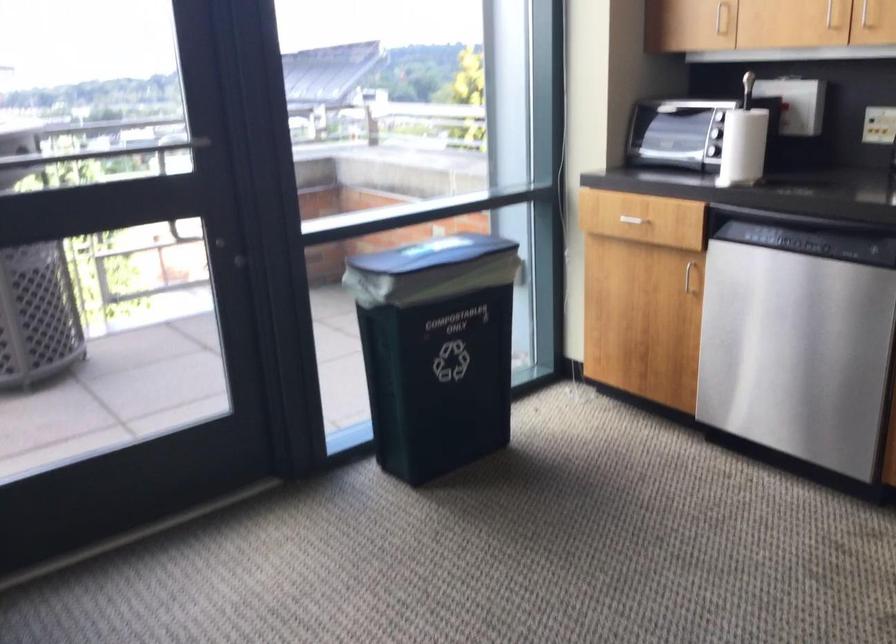
At what (x,y) coordinates should I click in order to perform the action: click on blue trash can lid. Please return your answer as a coordinate pair (x, y). This screenshot has width=896, height=644. Looking at the image, I should click on (431, 252).